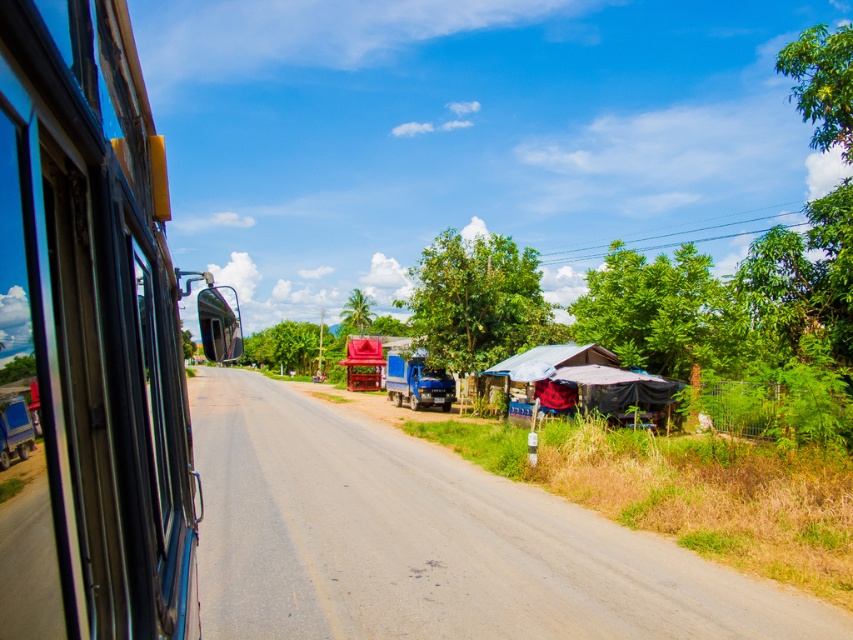
You are driving a delivery truck that needs to turn right onto a narrower path. You see the brown dirt track at lower right and the rusty corrugated hut at right in your view. Which path should you choose to ensure your truck fits through?

The brown dirt track at lower right is larger in size than the rusty corrugated hut at right, so you should choose the brown dirt track at lower right to ensure your truck fits through.

You are driving a delivery truck and need to turn left onto a dirt track. You see the brown dirt track at lower right and the rusty corrugated hut at right. Which object is closer to your current position?

The brown dirt track at lower right is closer to your current position because it is in front of the rusty corrugated hut at right, indicating it is nearer to the vehicle.

You are a passenger in a vehicle and want to know which object is taller between the blue glass train window at left and the rusty corrugated hut at right. Can you determine this based on the scene?

The blue glass train window at left is not as tall as the rusty corrugated hut at right, so the rusty corrugated hut at right is taller.